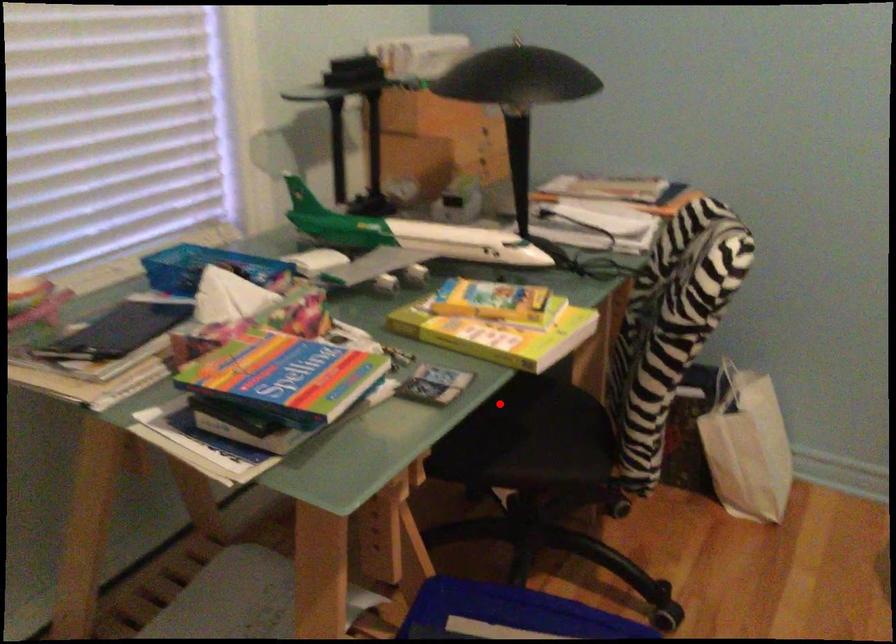
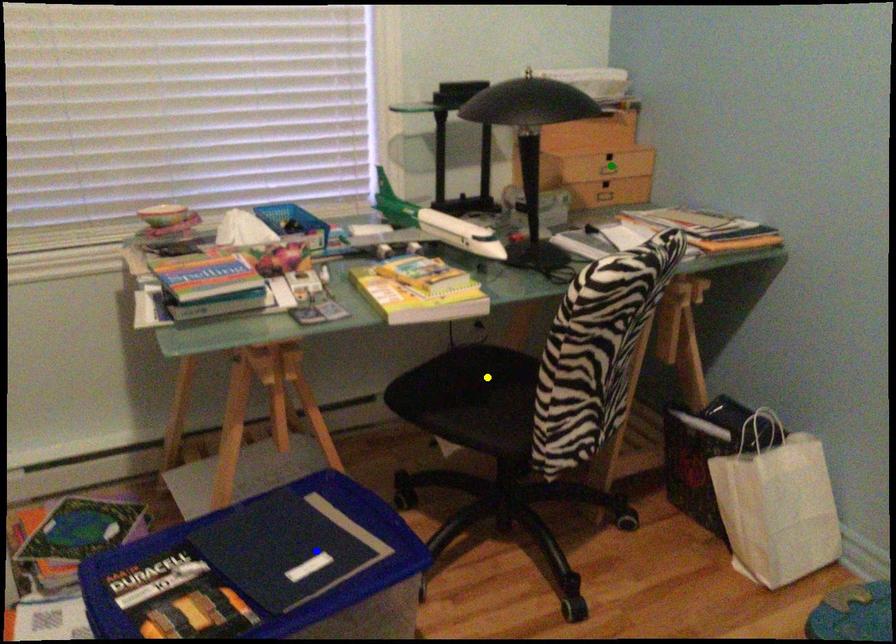
Question: I am providing you with two images of the same scene from different viewpoints. A red point is marked on the first image. You are given multiple points on the second image. Which point in image 2 is actually the same real-world point as the red point in image 1?

Choices:
 (A) green point
 (B) yellow point
 (C) blue point

Answer: (B)